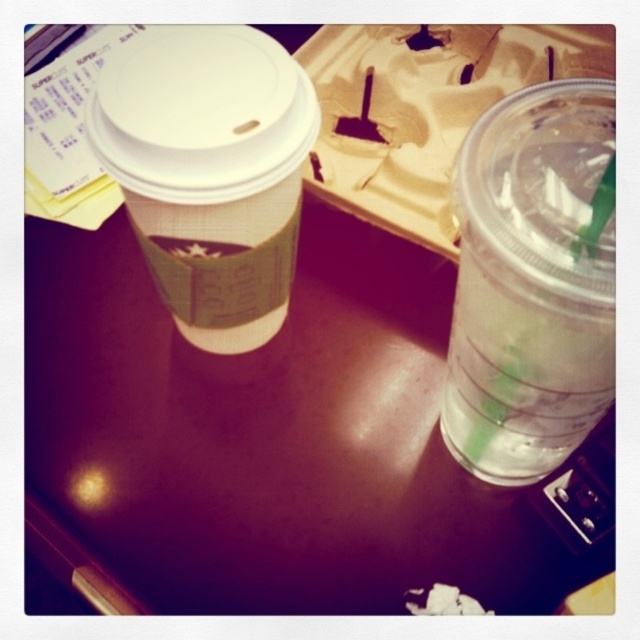
Between clear plastic cup at right and brown paper cup at upper left, which one has more height?

With more height is clear plastic cup at right.

Is clear plastic cup at right positioned behind brown paper cup at upper left?

That is False.

Find the location of `clear plastic cup at right`. clear plastic cup at right is located at coordinates (532, 282).